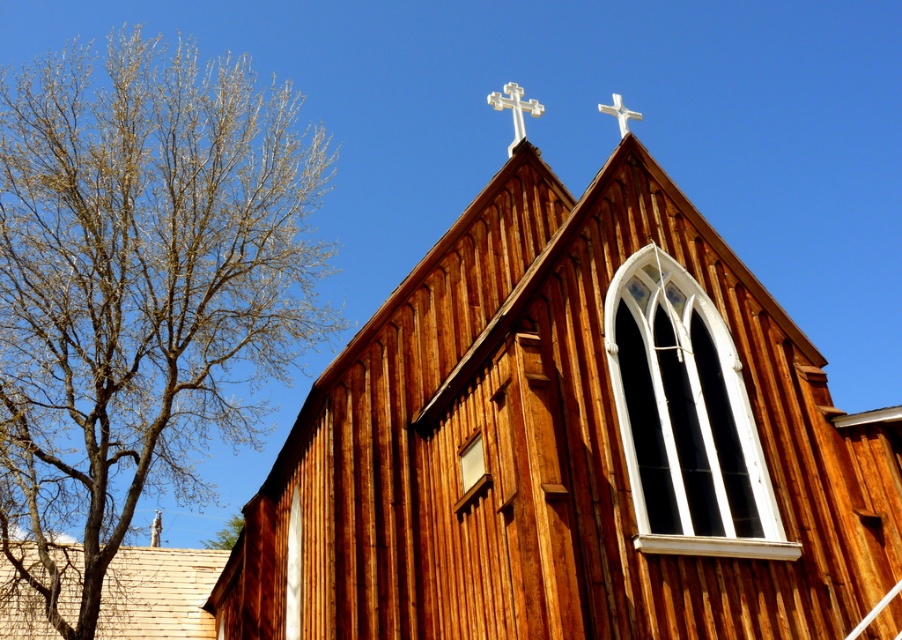
Is silver metallic cross at upper center closer to camera compared to white wooden cross at upper center?

No, it is not.

Which is in front, point (493, 93) or point (619, 128)?

Point (493, 93)

The height and width of the screenshot is (640, 902). Identify the location of silver metallic cross at upper center. (514, 109).

How distant is wooden chapel at upper center from bare wood tree at left?

A distance of 10.08 meters exists between wooden chapel at upper center and bare wood tree at left.

Can you confirm if wooden chapel at upper center is positioned below bare wood tree at left?

No.

What are the coordinates of `wooden chapel at upper center` in the screenshot? It's located at coord(573,444).

Is point (290, 572) farther from camera compared to point (511, 108)?

No, it is in front of (511, 108).

Which is behind, point (817, 381) or point (512, 97)?

The point (512, 97) is more distant.

Is point (624, 214) positioned behind point (519, 141)?

No, it is in front of (519, 141).

You are a GUI agent. You are given a task and a screenshot of the screen. Output one action in this format:
    pyautogui.click(x=<x>, y=<y>)
    Task: Click on the wooden chapel at upper center
    
    Given the screenshot: What is the action you would take?
    pyautogui.click(x=573, y=444)